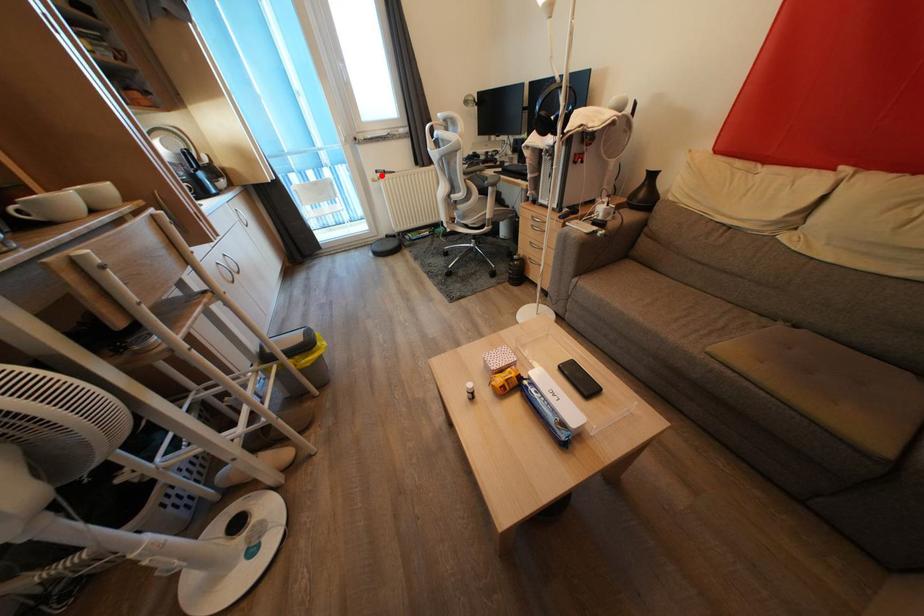
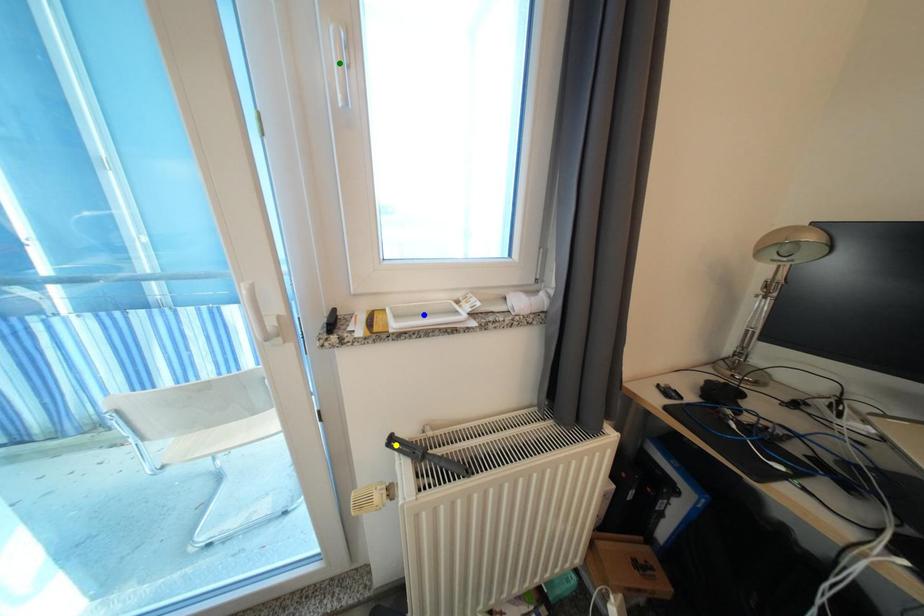
Question: I am providing you with two images of the same scene from different viewpoints. A red point is marked on the first image. You are given multiple points on the second image. In image 2, which mark is for the same physical point as the one in image 1?

Choices:
 (A) blue point
 (B) yellow point
 (C) green point

Answer: (B)